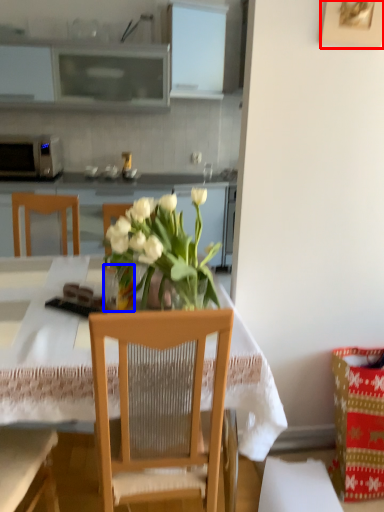
Question: Which object appears farthest to the camera in this image, picture frame (highlighted by a red box) or vase (highlighted by a blue box)?

Choices:
 (A) picture frame
 (B) vase

Answer: (B)